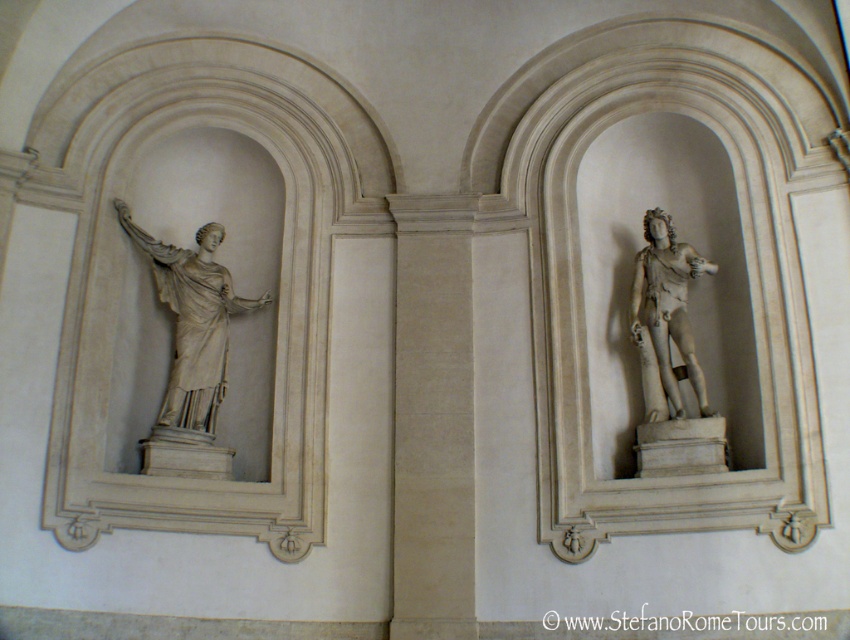
Is white marble statue at left to the right of white marble statue at right from the viewer's perspective?

In fact, white marble statue at left is to the left of white marble statue at right.

Does white marble statue at left have a lesser height compared to white marble statue at right?

Incorrect, white marble statue at left's height does not fall short of white marble statue at right's.

Image resolution: width=850 pixels, height=640 pixels. I want to click on white marble statue at left, so click(193, 323).